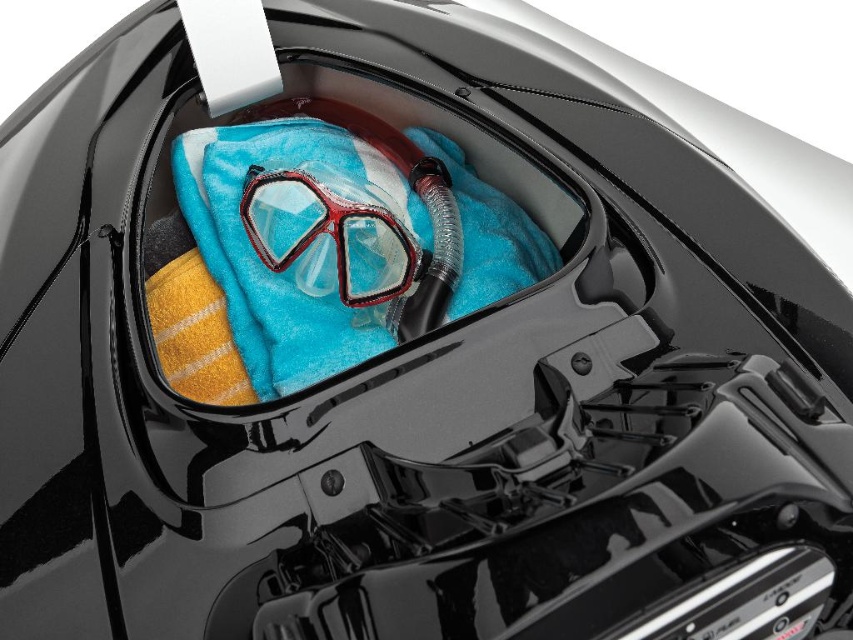
Question: Which point is farther to the camera?

Choices:
 (A) (285, 147)
 (B) (405, 275)

Answer: (A)

Question: Considering the relative positions of blue towel at center and clear plastic goggles at center in the image provided, where is blue towel at center located with respect to clear plastic goggles at center?

Choices:
 (A) above
 (B) below

Answer: (A)

Question: Considering the relative positions of blue towel at center and clear plastic goggles at center in the image provided, where is blue towel at center located with respect to clear plastic goggles at center?

Choices:
 (A) below
 (B) above

Answer: (B)

Question: Is blue towel at center above clear plastic goggles at center?

Choices:
 (A) yes
 (B) no

Answer: (A)